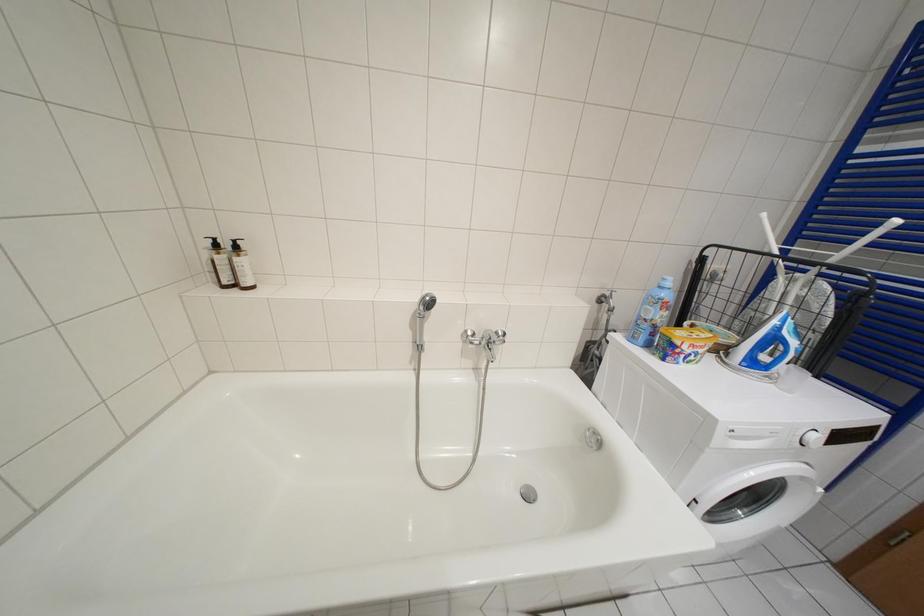
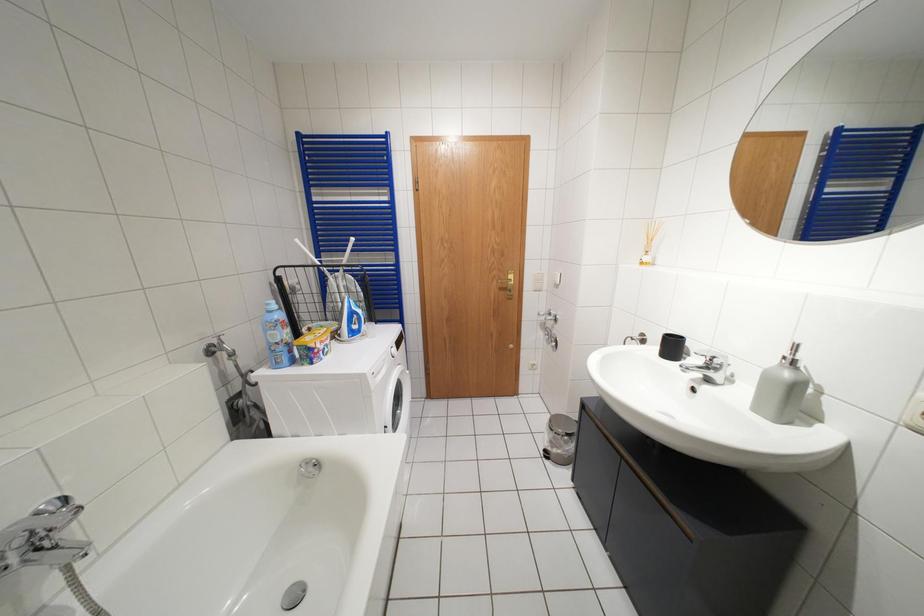
Based on the continuous images, in which direction is the camera rotating?

The camera's rotation is toward right-down.